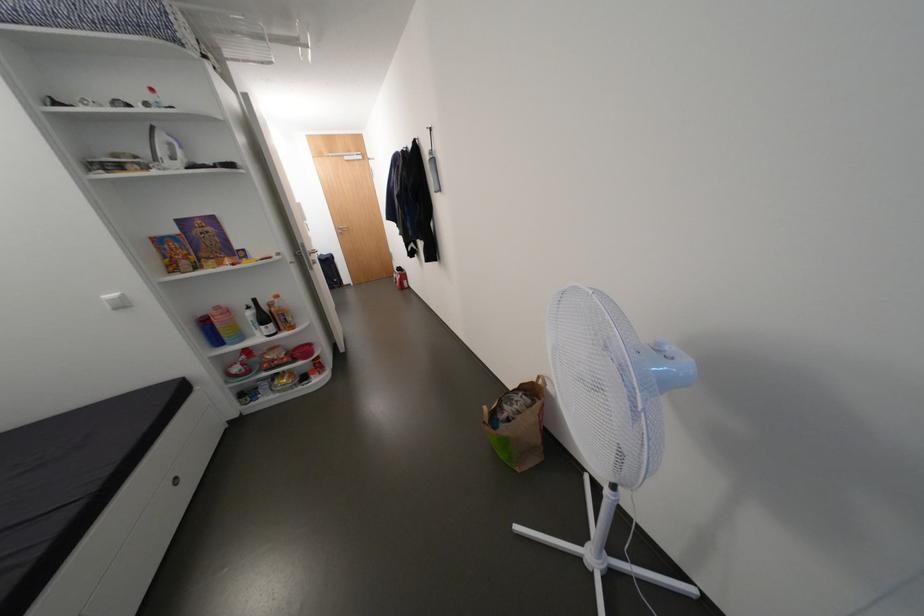
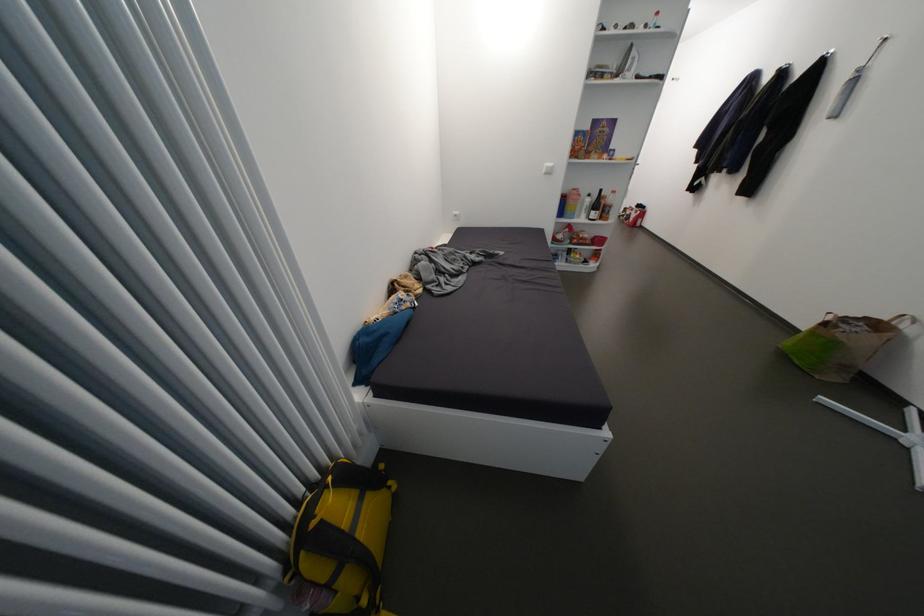
In the second image, find the point that corresponds to the point at 228,315 in the first image.

(585, 196)